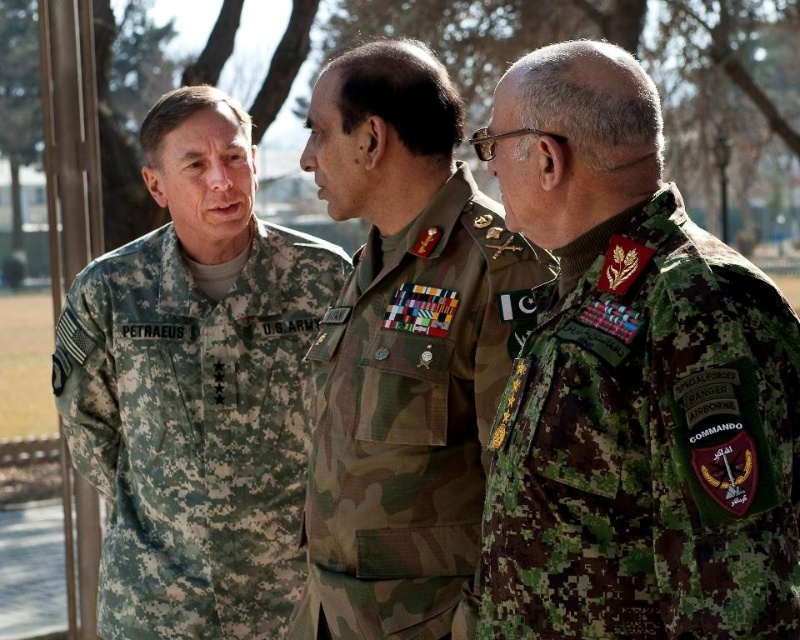
You are a photographer trying to capture a group photo of the digital camouflage uniform at right and the camouflage fabric military uniform at center. The camera you are using has a minimum focusing distance of 25 inches. Can you take the photo without moving either of the subjects?

The digital camouflage uniform at right and the camouflage fabric military uniform at center are 27.20 inches apart. Since the minimum focusing distance is 25 inches, the camera can focus on both subjects as they are within range, so yes, you can take the photo without moving either of the subjects.

In the scene where three military personnel are discussing near a building with a glass door on the left, there is a point at coordinates (x=648, y=445). Which object from the list below is located at that point? Choose from the options below. A. U.S. Army uniform with name PETRAEUS on left shoulder patch. B. Digital camouflage uniform at right.

The point at coordinates (x=648, y=445) corresponds to the digital camouflage uniform at right.